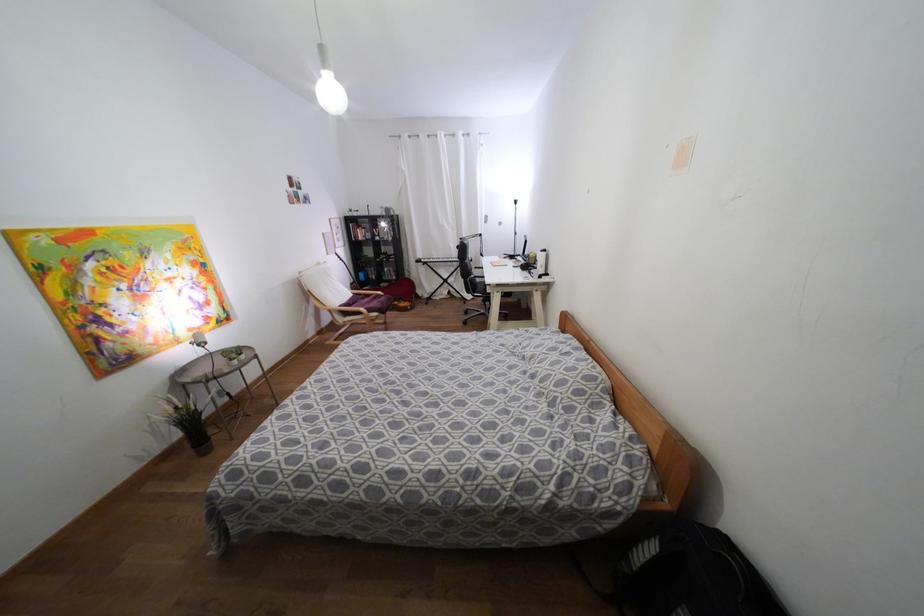
The height and width of the screenshot is (616, 924). What do you see at coordinates (475, 285) in the screenshot? I see `a black office chair armrest` at bounding box center [475, 285].